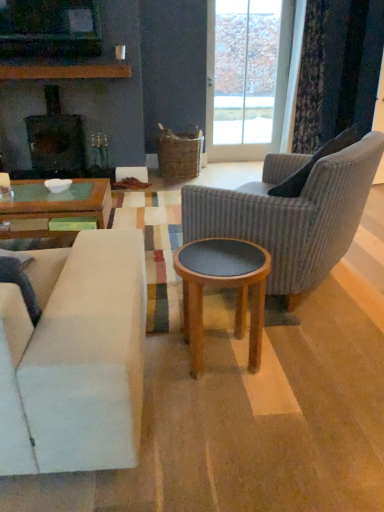
You are a GUI agent. You are given a task and a screenshot of the screen. Output one action in this format:
    pyautogui.click(x=<x>, y=<y>)
    Task: Click on the free space in front of ribbed fabric armchair at right
    The height and width of the screenshot is (512, 384).
    Given the screenshot: What is the action you would take?
    pyautogui.click(x=300, y=370)